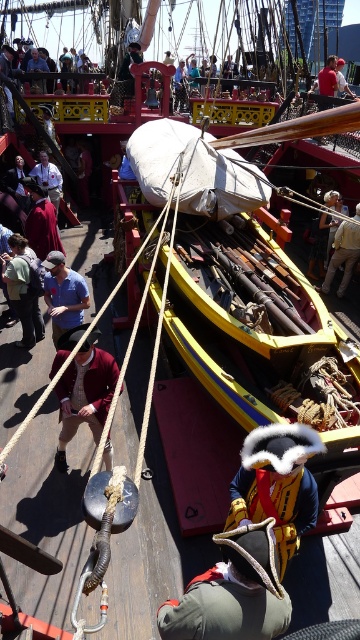
Can you confirm if green felt hat at center is wider than maroon wool coat at lower left?

In fact, green felt hat at center might be narrower than maroon wool coat at lower left.

Between point (254, 634) and point (78, 337), which one is positioned in front?

Point (254, 634)

Where is `green felt hat at center`? The height and width of the screenshot is (640, 360). green felt hat at center is located at coordinates (232, 593).

Which of these two, green felt hat at center or matte blue shirt at center, stands taller?

With more height is matte blue shirt at center.

Between point (285, 596) and point (60, 282), which one is positioned behind?

The point (60, 282) is behind.

Which is in front, point (176, 614) or point (43, 296)?

Point (176, 614) is in front.

Locate an element on the screen. green felt hat at center is located at coordinates (232, 593).

Does maroon wool coat at lower left come behind matte blue shirt at center?

No, it is not.

From the picture: Can you confirm if maroon wool coat at lower left is positioned above matte blue shirt at center?

No.

Between point (56, 355) and point (55, 305), which one is positioned in front?

Point (56, 355) is in front.

Locate an element on the screen. maroon wool coat at lower left is located at coordinates (84, 394).